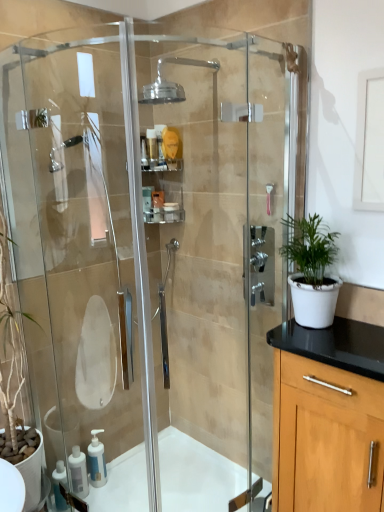
Locate an element on the screen. free spot to the right of translucent plastic soap dispenser at lower left, acting as the 1th soap dispenser starting from the left is located at coordinates (120, 494).